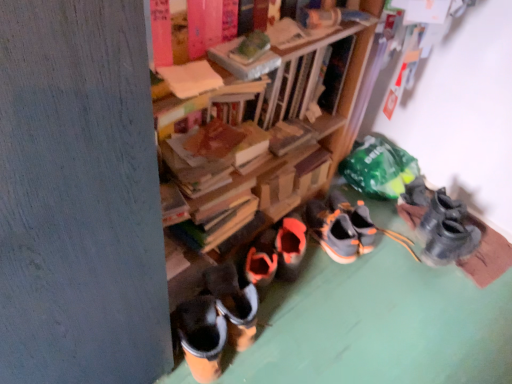
Identify the location of vacant area that lies in front of orange suede sneakers at center, positioned as the second footwear in right-to-left order. The width and height of the screenshot is (512, 384). (359, 277).